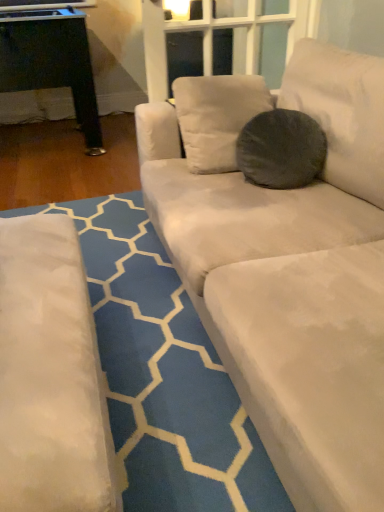
Where is `free point below white fabric couch at lower right (from a real-world perspective)`? free point below white fabric couch at lower right (from a real-world perspective) is located at coordinates (146, 330).